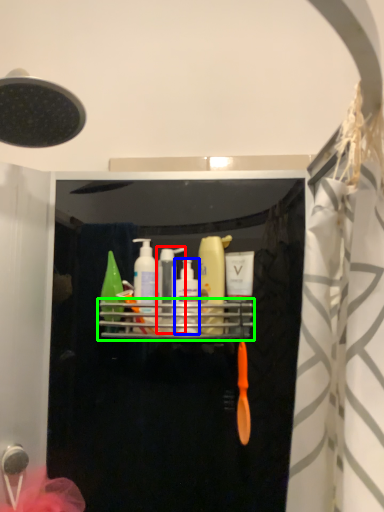
Question: Estimate the real-world distances between objects in this image. Which object is farther from toiletry (highlighted by a red box), mouthwash (highlighted by a blue box) or shelf (highlighted by a green box)?

Choices:
 (A) mouthwash
 (B) shelf

Answer: (B)